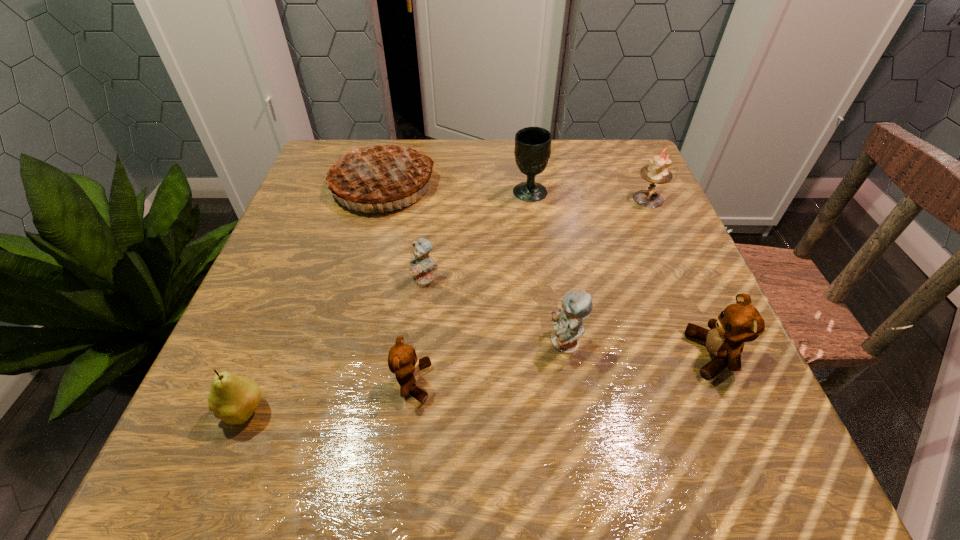
Where is `the smaller brown teddy bear`? the smaller brown teddy bear is located at coordinates pos(402,361).

You are a GUI agent. You are given a task and a screenshot of the screen. Output one action in this format:
    pyautogui.click(x=<x>, y=<y>)
    Task: Click on the vacant space located 0.080m on the front of the tallest object
    The image size is (960, 540).
    Given the screenshot: What is the action you would take?
    pyautogui.click(x=368, y=242)

What are the coordinates of `vacant position located 0.150m on the front of the chalice` in the screenshot? It's located at (537, 247).

Find the location of `free region located on the front of the candle holder`. free region located on the front of the candle holder is located at coordinates (699, 313).

You are a GUI agent. You are given a task and a screenshot of the screen. Output one action in this format:
    pyautogui.click(x=<x>, y=<y>)
    Task: Click on the blank space located 0.270m on the front-facing side of the right blue teddy bear
    This screenshot has width=960, height=540.
    Given the screenshot: What is the action you would take?
    pyautogui.click(x=385, y=342)

The image size is (960, 540). In order to click on free space located on the front-facing side of the right blue teddy bear in this screenshot , I will do `click(458, 342)`.

In order to click on free space located on the front-facing side of the right blue teddy bear in this screenshot , I will do `click(513, 342)`.

Locate an element on the screen. This screenshot has height=540, width=960. vacant position located 0.140m on the front-facing side of the rightmost teddy bear is located at coordinates (603, 355).

Image resolution: width=960 pixels, height=540 pixels. I want to click on free spot located on the front-facing side of the rightmost teddy bear, so click(x=497, y=355).

At what (x,y) coordinates should I click in order to perform the action: click on vacant region located on the front-facing side of the rightmost teddy bear. Please return your answer as a coordinate pair (x, y). The width and height of the screenshot is (960, 540). Looking at the image, I should click on (585, 355).